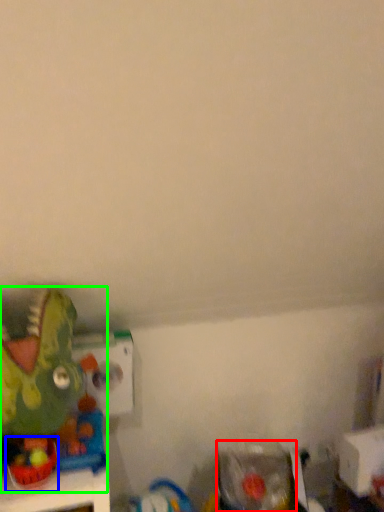
Question: Which object is positioned farthest from toy (highlighted by a red box)? Select from toy (highlighted by a blue box) and toy (highlighted by a green box).

Choices:
 (A) toy
 (B) toy

Answer: (A)